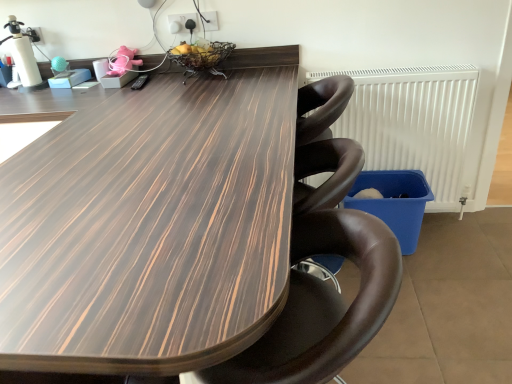
The height and width of the screenshot is (384, 512). I want to click on free spot above wooden table at center (from a real-world perspective), so click(139, 171).